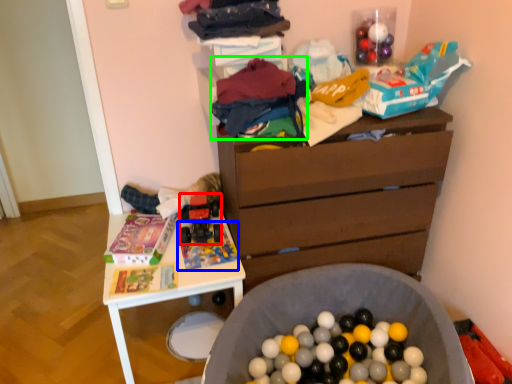
Question: Considering the real-world distances, which object is closest to toy (highlighted by a red box)? toy (highlighted by a blue box) or clothing (highlighted by a green box).

Choices:
 (A) toy
 (B) clothing

Answer: (A)